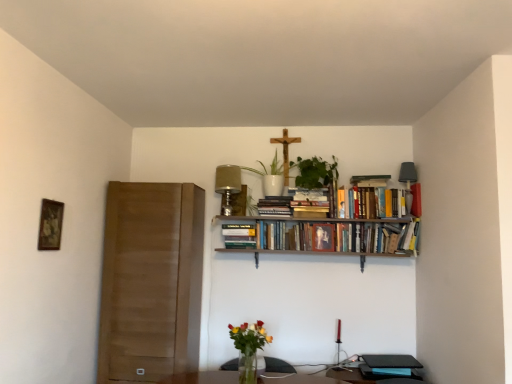
Question: Based on their positions, is hardcover book at upper right, which is counted as the fifth book, starting from the left, located to the left or right of hardcover books at upper center, which is the third book from right to left?

Choices:
 (A) left
 (B) right

Answer: (B)

Question: Is hardcover book at upper right, which is counted as the fifth book, starting from the left, bigger or smaller than hardcover books at upper center, which is the third book from right to left?

Choices:
 (A) small
 (B) big

Answer: (A)

Question: Estimate the real-world distances between objects in this image. Which object is closer to the wooden crucifix at upper center?

Choices:
 (A) hardcover books at center, which ranks as the 4th book in right-to-left order
 (B) hardcover book at upper right, which is counted as the fifth book, starting from the left
 (C) hardcover books at upper center
 (D) green leafy plant at upper center, the 1th plant positioned from the right
 (E) white ceramic pot at upper center, marked as the 2th plant in a right-to-left arrangement

Answer: (E)

Question: Estimate the real-world distances between objects in this image. Which object is closer to the hardcover book at center, the 5th book positioned from the right?

Choices:
 (A) hardcover books at upper center
 (B) hardcover books at center, which ranks as the 4th book in right-to-left order
 (C) translucent glass vase at lower center
 (D) hardcover books at upper center, which is the third book from right to left
 (E) wooden crucifix at upper center

Answer: (A)